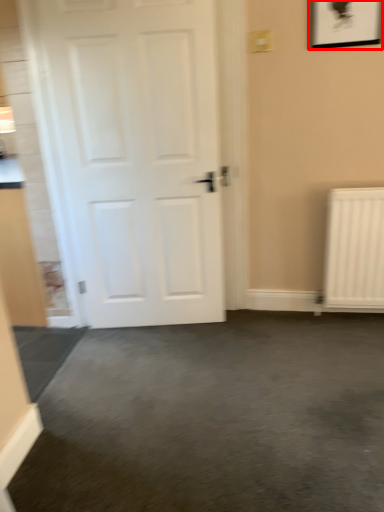
Question: From the image's perspective, what is the correct spatial positioning of picture frame (annotated by the red box) in reference to door?

Choices:
 (A) below
 (B) above

Answer: (B)